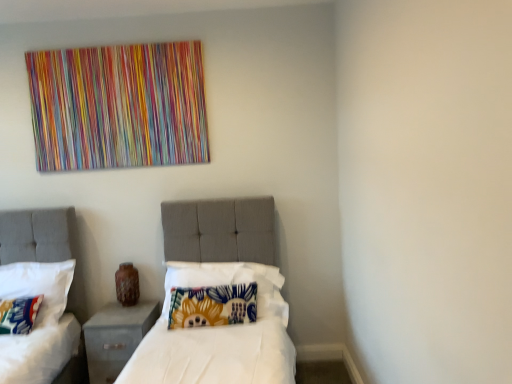
Find the location of a particular element. floral fabric pillow at left, the second pillow positioned from the right is located at coordinates (39, 286).

Describe the element at coordinates (18, 315) in the screenshot. I see `fluffy multicolored pillow at lower left, arranged as the first pillow when viewed from the left` at that location.

In order to click on gray fabric nightstand at lower left in this screenshot , I will do `click(116, 337)`.

Can you confirm if fluffy multicolored pillow at lower left, arranged as the first pillow when viewed from the left, is positioned to the left of floral fabric pillow at center, which appears as the first pillow when viewed from the right?

Yes.

Considering the sizes of objects fluffy multicolored pillow at lower left, placed as the third pillow when sorted from right to left, and floral fabric pillow at center, which appears as the first pillow when viewed from the right, in the image provided, who is thinner, fluffy multicolored pillow at lower left, placed as the third pillow when sorted from right to left, or floral fabric pillow at center, which appears as the first pillow when viewed from the right,?

With smaller width is floral fabric pillow at center, which appears as the first pillow when viewed from the right.

Which is behind, point (16, 326) or point (199, 295)?

Positioned behind is point (199, 295).

What's the angular difference between fluffy multicolored pillow at lower left, placed as the third pillow when sorted from right to left, and floral fabric pillow at center, the third pillow positioned from the left,'s facing directions?

fluffy multicolored pillow at lower left, placed as the third pillow when sorted from right to left, and floral fabric pillow at center, the third pillow positioned from the left, are facing 175 degrees away from each other.

Is point (212, 294) positioned behind point (47, 314)?

That is False.

Find the location of a particular element. pillow to the right of floral fabric pillow at left, positioned as the second pillow in left-to-right order is located at coordinates (213, 305).

Is floral fabric pillow at left, the second pillow positioned from the right, at the back of floral fabric pillow at center, the third pillow positioned from the left?

No, floral fabric pillow at center, the third pillow positioned from the left,'s orientation is not away from floral fabric pillow at left, the second pillow positioned from the right.

Which is less distant, (x=50, y=297) or (x=234, y=284)?

Clearly, point (x=50, y=297) is more distant from the camera than point (x=234, y=284).

How different are the orientations of floral fabric pillow at left, the second pillow positioned from the right, and floral fabric pillow at center, which appears as the first pillow when viewed from the right, in degrees?

1.68 degrees separate the facing orientations of floral fabric pillow at left, the second pillow positioned from the right, and floral fabric pillow at center, which appears as the first pillow when viewed from the right.

In terms of width, does floral fabric pillow at left, positioned as the second pillow in left-to-right order, look wider or thinner when compared to floral fabric pillow at center, the third pillow positioned from the left?

Considering their sizes, floral fabric pillow at left, positioned as the second pillow in left-to-right order, looks broader than floral fabric pillow at center, the third pillow positioned from the left.

Looking at this image, is fluffy multicolored pillow at lower left, placed as the third pillow when sorted from right to left, far away from gray fabric nightstand at lower left?

That's not correct — fluffy multicolored pillow at lower left, placed as the third pillow when sorted from right to left, is a little close to gray fabric nightstand at lower left.

From the image's perspective, which object appears higher, fluffy multicolored pillow at lower left, arranged as the first pillow when viewed from the left, or gray fabric nightstand at lower left?

fluffy multicolored pillow at lower left, arranged as the first pillow when viewed from the left, is shown above in the image.

Does point (12, 311) appear closer or farther from the camera than point (142, 338)?

Point (12, 311) is positioned farther from the camera compared to point (142, 338).

Could gray fabric nightstand at lower left be considered to be inside fluffy multicolored pillow at lower left, arranged as the first pillow when viewed from the left?

No, fluffy multicolored pillow at lower left, arranged as the first pillow when viewed from the left, does not contain gray fabric nightstand at lower left.

Is gray fabric nightstand at lower left not inside fluffy multicolored pillow at lower left, placed as the third pillow when sorted from right to left?

Yes, gray fabric nightstand at lower left is not within fluffy multicolored pillow at lower left, placed as the third pillow when sorted from right to left.

Is point (114, 313) positioned after point (1, 328)?

Yes, it is behind point (1, 328).

How different are the orientations of gray fabric nightstand at lower left and fluffy multicolored pillow at lower left, arranged as the first pillow when viewed from the left, in degrees?

They differ by 178 degrees in their facing directions.

From the image's perspective, is gray fabric nightstand at lower left above or below fluffy multicolored pillow at lower left, placed as the third pillow when sorted from right to left?

Based on their image positions, gray fabric nightstand at lower left is located beneath fluffy multicolored pillow at lower left, placed as the third pillow when sorted from right to left.

Can you confirm if floral fabric pillow at center, the third pillow positioned from the left, is positioned to the right of gray fabric nightstand at lower left?

Indeed, floral fabric pillow at center, the third pillow positioned from the left, is positioned on the right side of gray fabric nightstand at lower left.

From the image's perspective, which object appears higher, floral fabric pillow at center, the third pillow positioned from the left, or gray fabric nightstand at lower left?

floral fabric pillow at center, the third pillow positioned from the left, appears higher in the image.

Identify the location of the 2nd pillow directly above the gray fabric nightstand at lower left (from a real-world perspective). Image resolution: width=512 pixels, height=384 pixels. (213, 305).

From a real-world perspective, relative to gray fabric nightstand at lower left, is floral fabric pillow at center, the third pillow positioned from the left, vertically above or below?

In terms of real-world spatial position, floral fabric pillow at center, the third pillow positioned from the left, is above gray fabric nightstand at lower left.

How different are the orientations of fluffy multicolored pillow at lower left, arranged as the first pillow when viewed from the left, and floral fabric pillow at left, the second pillow positioned from the right, in degrees?

They differ by 177 degrees in their facing directions.

Can we say fluffy multicolored pillow at lower left, arranged as the first pillow when viewed from the left, lies outside floral fabric pillow at left, the second pillow positioned from the right?

That's incorrect, fluffy multicolored pillow at lower left, arranged as the first pillow when viewed from the left, is not completely outside floral fabric pillow at left, the second pillow positioned from the right.

Which of these two, fluffy multicolored pillow at lower left, placed as the third pillow when sorted from right to left, or floral fabric pillow at left, positioned as the second pillow in left-to-right order, stands taller?

floral fabric pillow at left, positioned as the second pillow in left-to-right order, is taller.

Considering the positions of point (20, 306) and point (11, 277), is point (20, 306) closer or farther from the camera than point (11, 277)?

Point (20, 306) is closer to the camera than point (11, 277).

At what (x,y) coordinates should I click in order to perform the action: click on pillow in front of the fluffy multicolored pillow at lower left, arranged as the first pillow when viewed from the left. Please return your answer as a coordinate pair (x, y). This screenshot has width=512, height=384. Looking at the image, I should click on (213, 305).

There is a floral fabric pillow at left, the second pillow positioned from the right. In order to click on the 1st pillow below it (from a real-world perspective) in this screenshot , I will do point(213,305).

Looking at this image, based on their spatial positions, is fluffy multicolored pillow at lower left, arranged as the first pillow when viewed from the left, or gray fabric nightstand at lower left further from floral fabric pillow at center, which appears as the first pillow when viewed from the right?

fluffy multicolored pillow at lower left, arranged as the first pillow when viewed from the left, is further to floral fabric pillow at center, which appears as the first pillow when viewed from the right.

Estimate the real-world distances between objects in this image. Which object is closer to gray fabric nightstand at lower left, floral fabric pillow at left, positioned as the second pillow in left-to-right order, or fluffy multicolored pillow at lower left, placed as the third pillow when sorted from right to left?

floral fabric pillow at left, positioned as the second pillow in left-to-right order, lies closer to gray fabric nightstand at lower left than the other object.

From the image, which object appears to be nearer to gray fabric nightstand at lower left, floral fabric pillow at center, which appears as the first pillow when viewed from the right, or fluffy multicolored pillow at lower left, placed as the third pillow when sorted from right to left?

floral fabric pillow at center, which appears as the first pillow when viewed from the right, lies closer to gray fabric nightstand at lower left than the other object.

From the image, which object appears to be nearer to fluffy multicolored pillow at lower left, arranged as the first pillow when viewed from the left, floral fabric pillow at left, positioned as the second pillow in left-to-right order, or floral fabric pillow at center, the third pillow positioned from the left?

Based on the image, floral fabric pillow at left, positioned as the second pillow in left-to-right order, appears to be nearer to fluffy multicolored pillow at lower left, arranged as the first pillow when viewed from the left.

From the image, which object appears to be farther from floral fabric pillow at left, positioned as the second pillow in left-to-right order, floral fabric pillow at center, the third pillow positioned from the left, or fluffy multicolored pillow at lower left, arranged as the first pillow when viewed from the left?

floral fabric pillow at center, the third pillow positioned from the left, lies further to floral fabric pillow at left, positioned as the second pillow in left-to-right order, than the other object.

Looking at the image, which one is located closer to fluffy multicolored pillow at lower left, placed as the third pillow when sorted from right to left, floral fabric pillow at left, positioned as the second pillow in left-to-right order, or gray fabric nightstand at lower left?

Among the two, floral fabric pillow at left, positioned as the second pillow in left-to-right order, is located nearer to fluffy multicolored pillow at lower left, placed as the third pillow when sorted from right to left.

From the image, which object appears to be farther from fluffy multicolored pillow at lower left, arranged as the first pillow when viewed from the left, floral fabric pillow at center, which appears as the first pillow when viewed from the right, or gray fabric nightstand at lower left?

floral fabric pillow at center, which appears as the first pillow when viewed from the right.

Consider the image. Which object lies nearer to the anchor point gray fabric nightstand at lower left, floral fabric pillow at left, the second pillow positioned from the right, or floral fabric pillow at center, the third pillow positioned from the left?

floral fabric pillow at center, the third pillow positioned from the left, lies closer to gray fabric nightstand at lower left than the other object.

Image resolution: width=512 pixels, height=384 pixels. I want to click on pillow located between fluffy multicolored pillow at lower left, placed as the third pillow when sorted from right to left, and gray fabric nightstand at lower left in the left-right direction, so click(x=39, y=286).

This screenshot has height=384, width=512. I want to click on pillow between fluffy multicolored pillow at lower left, placed as the third pillow when sorted from right to left, and floral fabric pillow at center, the third pillow positioned from the left, in the horizontal direction, so click(39, 286).

Locate an element on the screen. nightstand located between fluffy multicolored pillow at lower left, arranged as the first pillow when viewed from the left, and floral fabric pillow at center, the third pillow positioned from the left, in the left-right direction is located at coordinates (116, 337).

At what (x,y) coordinates should I click in order to perform the action: click on nightstand located between floral fabric pillow at left, positioned as the second pillow in left-to-right order, and floral fabric pillow at center, the third pillow positioned from the left, in the left-right direction. Please return your answer as a coordinate pair (x, y). This screenshot has height=384, width=512. Looking at the image, I should click on (116, 337).